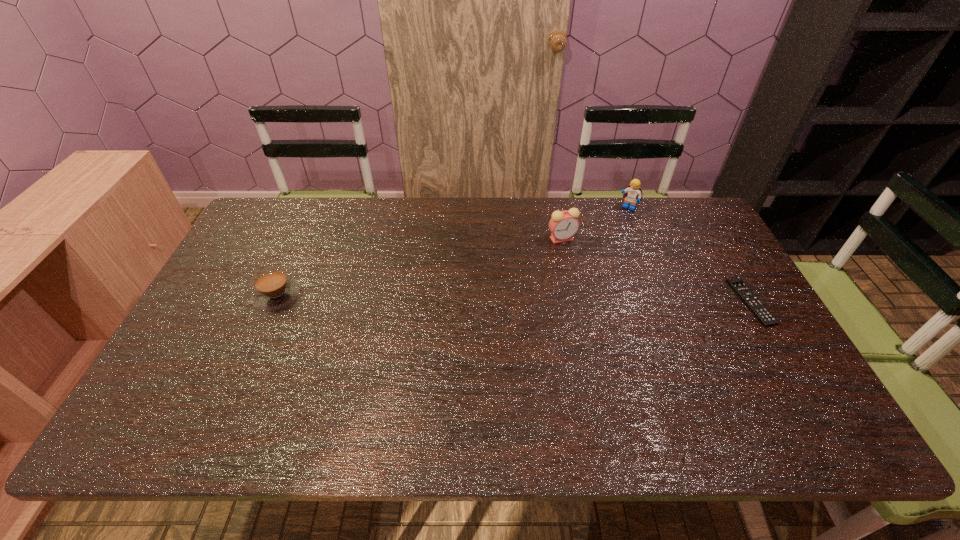
Identify the location of the second shortest object. (273, 289).

Find the location of a particular element. Image resolution: width=960 pixels, height=540 pixels. the leftmost object is located at coordinates (273, 289).

Locate an element on the screen. This screenshot has width=960, height=540. the rightmost object is located at coordinates (766, 318).

Locate an element on the screen. The height and width of the screenshot is (540, 960). remote control is located at coordinates (766, 318).

Locate an element on the screen. The width and height of the screenshot is (960, 540). alarm clock is located at coordinates pos(563,225).

I want to click on the second farthest object, so click(x=563, y=225).

The image size is (960, 540). What are the coordinates of `Lego` in the screenshot? It's located at pos(633,193).

This screenshot has width=960, height=540. I want to click on the second object from right to left, so click(x=633, y=193).

You are a GUI agent. You are given a task and a screenshot of the screen. Output one action in this format:
    pyautogui.click(x=<x>, y=<y>)
    Task: Click on the vacant space situated on the back of the leftmost object
    
    Given the screenshot: What is the action you would take?
    pos(298,249)

Find the location of `free region located on the back of the remote control`. free region located on the back of the remote control is located at coordinates (708, 230).